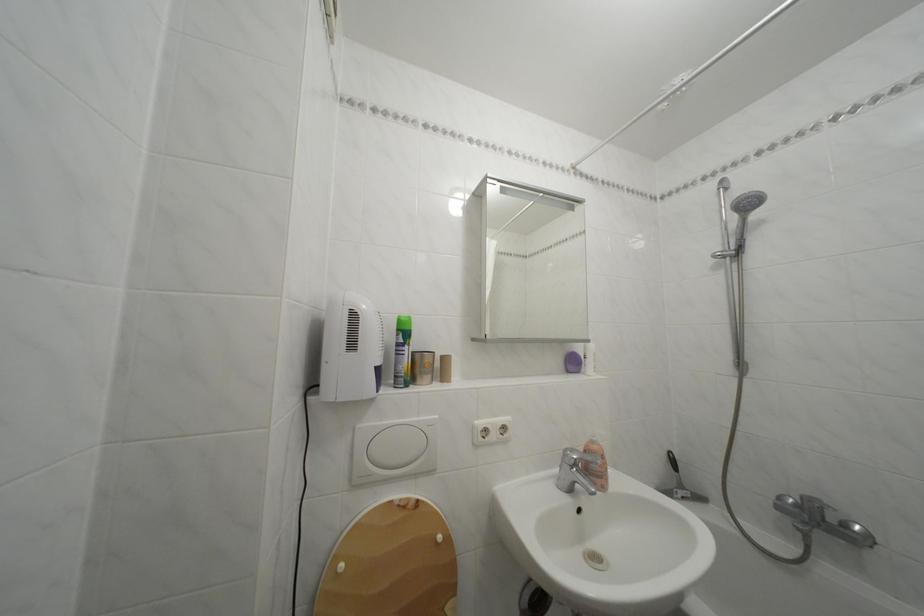
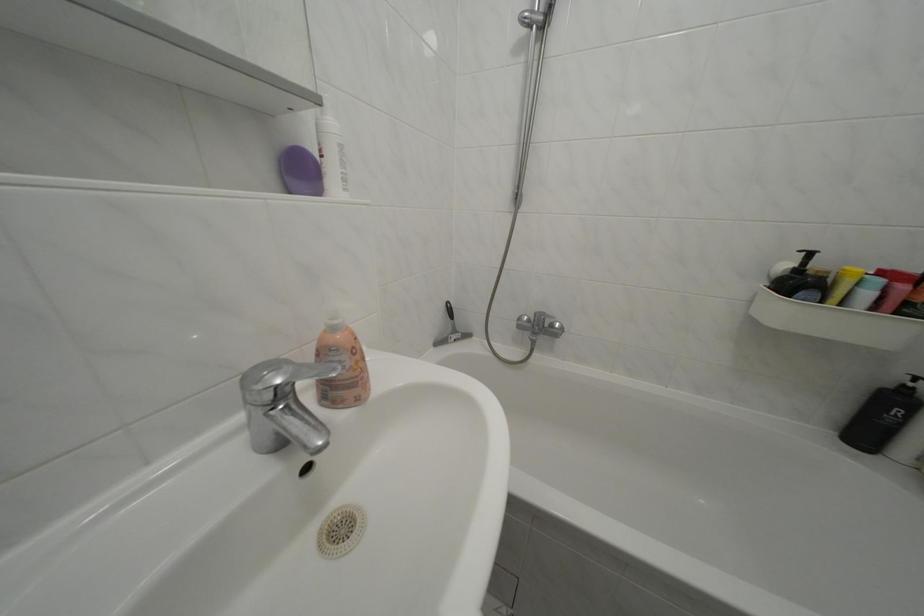
In the second image, find the point that corresponds to the point at 854,531 in the first image.

(562, 331)